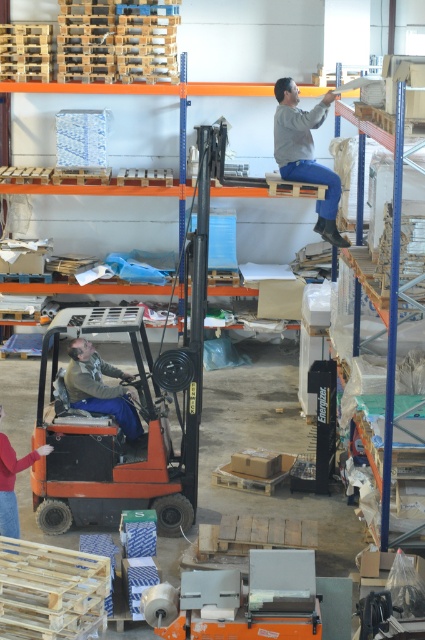
Does orange matte forklift at center come in front of red sweater at lower left?

No, orange matte forklift at center is further to the viewer.

Which is in front, point (51, 461) or point (8, 472)?

Point (8, 472) is in front.

What do you see at coordinates (112, 440) in the screenshot?
I see `orange matte forklift at center` at bounding box center [112, 440].

This screenshot has height=640, width=425. In order to click on orange matte forklift at center in this screenshot , I will do `click(112, 440)`.

Does orange matte forklift at center appear over blue denim pants at lower left?

Actually, orange matte forklift at center is below blue denim pants at lower left.

Which is more to the left, orange matte forklift at center or blue denim pants at lower left?

blue denim pants at lower left

Where is `orange matte forklift at center`? This screenshot has width=425, height=640. orange matte forklift at center is located at coordinates [x=112, y=440].

Image resolution: width=425 pixels, height=640 pixels. I want to click on orange matte forklift at center, so click(112, 440).

Is point (333, 236) farther from viewer compared to point (2, 461)?

Yes, it is behind point (2, 461).

Between gray fabric pants at upper center and red sweater at lower left, which one has more height?

gray fabric pants at upper center is taller.

Who is more forward, (300, 150) or (0, 406)?

Point (0, 406)

Locate an element on the screen. Image resolution: width=425 pixels, height=640 pixels. gray fabric pants at upper center is located at coordinates (306, 154).